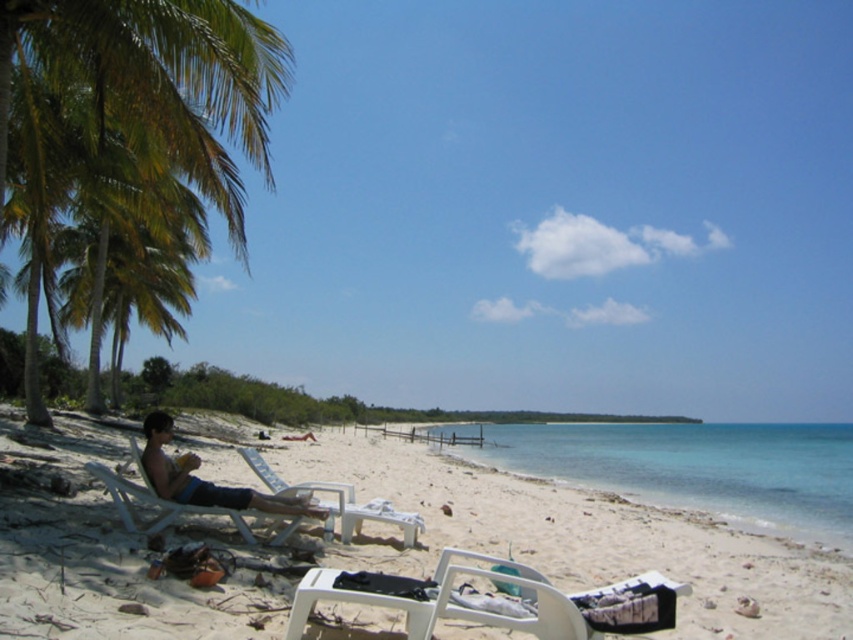
You are a beachgoer who wants to place a small umbrella on the beach. You have a clear blue water at lower center and a white plastic chair at left in view. Which object can you place the umbrella next to without it being submerged in water?

The white plastic chair at left is a suitable location to place the umbrella next to since the clear blue water at lower center is a body of water and cannot support an umbrella placement.

You are a beachgoer who wants to choose a chair that is shorter in height. Based on the scene, which chair between the matte black lounge chair at lower left and the white plastic chair at left should you select?

The white plastic chair at left is shorter than the matte black lounge chair at lower left, so you should choose the white plastic chair at left.

You are standing at the center of the beach and want to move towards the ocean. Which direction should you go to avoid passing between the matte black lounge chair at lower left and the white plastic chair at left?

Since the matte black lounge chair at lower left is to the left of the white plastic chair at left, you should move to the right of the white plastic chair at left to avoid passing between them and head towards the ocean.